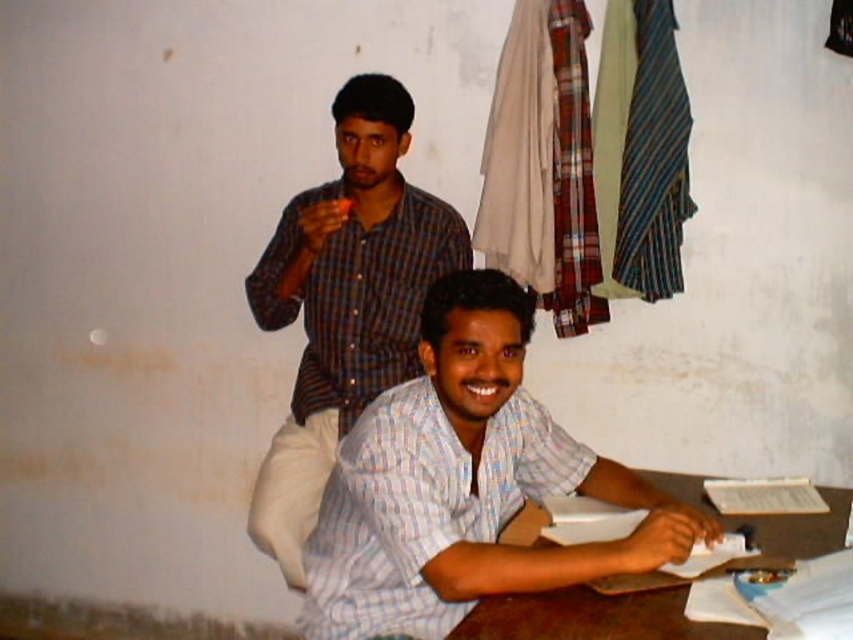
Question: Which object is farther from the camera taking this photo?

Choices:
 (A) light blue checkered shirt at center
 (B) brown wooden table at lower right

Answer: (A)

Question: Which point is closer to the camera taking this photo?

Choices:
 (A) (294, 387)
 (B) (461, 493)
 (C) (521, 621)

Answer: (C)

Question: Which point is closer to the camera?

Choices:
 (A) checkered fabric shirt at upper center
 (B) brown wooden table at lower right

Answer: (B)

Question: Is the position of light blue checkered shirt at center less distant than that of brown wooden table at lower right?

Choices:
 (A) no
 (B) yes

Answer: (A)

Question: Can you confirm if checkered fabric shirt at upper center is thinner than brown wooden table at lower right?

Choices:
 (A) no
 (B) yes

Answer: (A)

Question: Is light blue checkered shirt at center positioned in front of checkered fabric shirt at upper center?

Choices:
 (A) yes
 (B) no

Answer: (A)